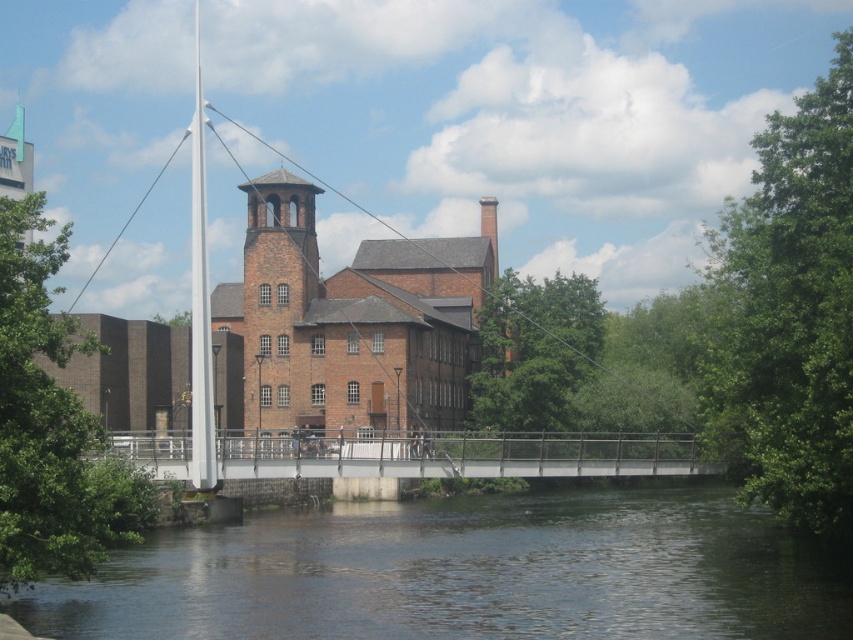
Question: Considering the real-world distances, which object is farthest from the brown brick tower at center?

Choices:
 (A) white glossy mast at center-left
 (B) dark brown water at lower center
 (C) metallic gray bridge at center

Answer: (B)

Question: Considering the real-world distances, which object is closest to the brown brick tower at center?

Choices:
 (A) metallic gray bridge at center
 (B) dark brown water at lower center

Answer: (A)

Question: Can you confirm if dark brown water at lower center is positioned to the left of white glossy mast at center-left?

Choices:
 (A) no
 (B) yes

Answer: (A)

Question: Which point is closer to the camera?

Choices:
 (A) white glossy mast at center-left
 (B) brown brick tower at center

Answer: (A)

Question: Does dark brown water at lower center appear on the right side of white glossy mast at center-left?

Choices:
 (A) yes
 (B) no

Answer: (A)

Question: Does dark brown water at lower center come in front of metallic gray bridge at center?

Choices:
 (A) no
 (B) yes

Answer: (B)